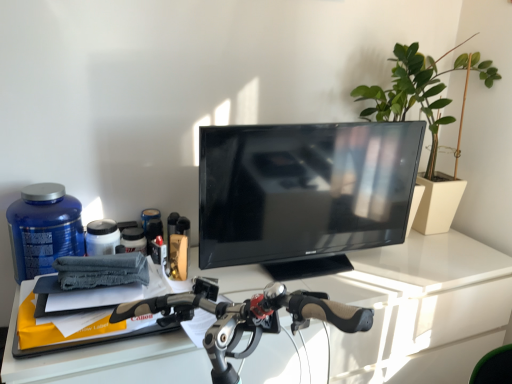
Question: Is white glossy desk at center outside green matte plant at upper right?

Choices:
 (A) no
 (B) yes

Answer: (B)

Question: Is white glossy desk at center not near green matte plant at upper right?

Choices:
 (A) yes
 (B) no

Answer: (B)

Question: From a real-world perspective, is white glossy desk at center positioned over green matte plant at upper right based on gravity?

Choices:
 (A) yes
 (B) no

Answer: (B)

Question: Is white glossy desk at center taller than green matte plant at upper right?

Choices:
 (A) no
 (B) yes

Answer: (B)

Question: From the image's perspective, is white glossy desk at center beneath green matte plant at upper right?

Choices:
 (A) yes
 (B) no

Answer: (A)

Question: Looking at the image, does white glossy desk at center seem bigger or smaller compared to green matte plant at upper right?

Choices:
 (A) small
 (B) big

Answer: (B)

Question: Is white glossy desk at center inside or outside of green matte plant at upper right?

Choices:
 (A) inside
 (B) outside

Answer: (B)

Question: Is point (450, 324) closer or farther from the camera than point (424, 97)?

Choices:
 (A) closer
 (B) farther

Answer: (A)

Question: In the image, is white glossy desk at center positioned in front of or behind green matte plant at upper right?

Choices:
 (A) front
 (B) behind

Answer: (A)

Question: In terms of height, does white glossy desk at center look taller or shorter compared to blue matte bottle at left?

Choices:
 (A) short
 (B) tall

Answer: (B)

Question: Considering the relative positions of white glossy desk at center and blue matte bottle at left in the image provided, is white glossy desk at center to the left or to the right of blue matte bottle at left?

Choices:
 (A) right
 (B) left

Answer: (A)

Question: In terms of width, does white glossy desk at center look wider or thinner when compared to blue matte bottle at left?

Choices:
 (A) wide
 (B) thin

Answer: (A)

Question: Is white glossy desk at center in front of or behind blue matte bottle at left in the image?

Choices:
 (A) front
 (B) behind

Answer: (A)

Question: Considering the relative positions of black glossy tv at center and green matte plant at upper right in the image provided, is black glossy tv at center to the left or to the right of green matte plant at upper right?

Choices:
 (A) right
 (B) left

Answer: (B)

Question: Looking at the image, does black glossy tv at center seem bigger or smaller compared to green matte plant at upper right?

Choices:
 (A) big
 (B) small

Answer: (B)